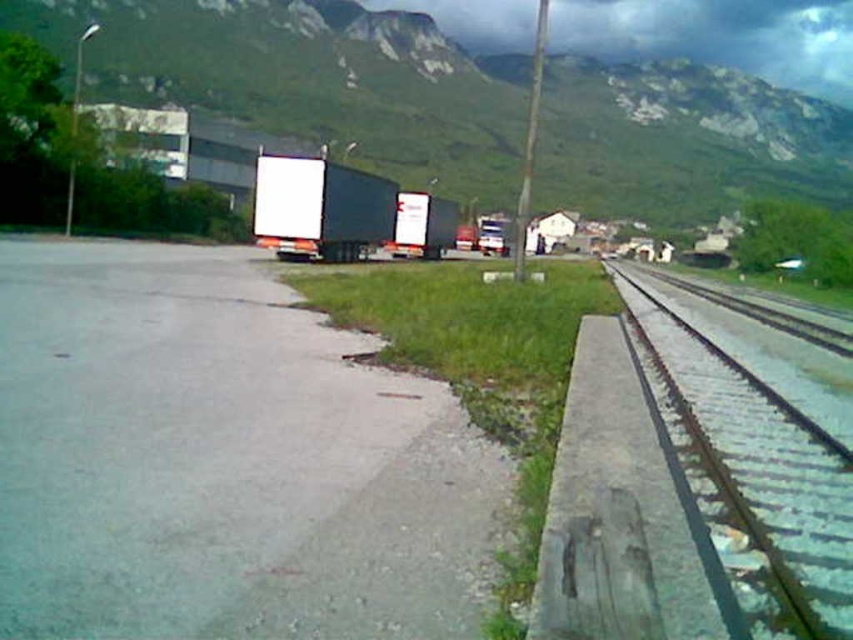
Is green grassy mountain at upper center below matte black trailer truck at center?

No.

How distant is green grassy mountain at upper center from matte black trailer truck at center?

They are 55.77 meters apart.

Describe the element at coordinates (310, 77) in the screenshot. I see `green grassy mountain at upper center` at that location.

Locate an element on the screen. green grassy mountain at upper center is located at coordinates (310, 77).

Does green grassy mountain at upper center have a larger size compared to green metallic track at right?

Yes.

Does point (512, 188) lie behind point (769, 532)?

Yes, it is.

Where is `green grassy mountain at upper center`? The image size is (853, 640). green grassy mountain at upper center is located at coordinates (310, 77).

Does green metallic track at right have a greater height compared to matte black trailer truck at center?

No, green metallic track at right is not taller than matte black trailer truck at center.

Does point (665, 285) come closer to viewer compared to point (263, 202)?

No, (665, 285) is behind (263, 202).

Find the location of `green metallic track at right`. green metallic track at right is located at coordinates (753, 461).